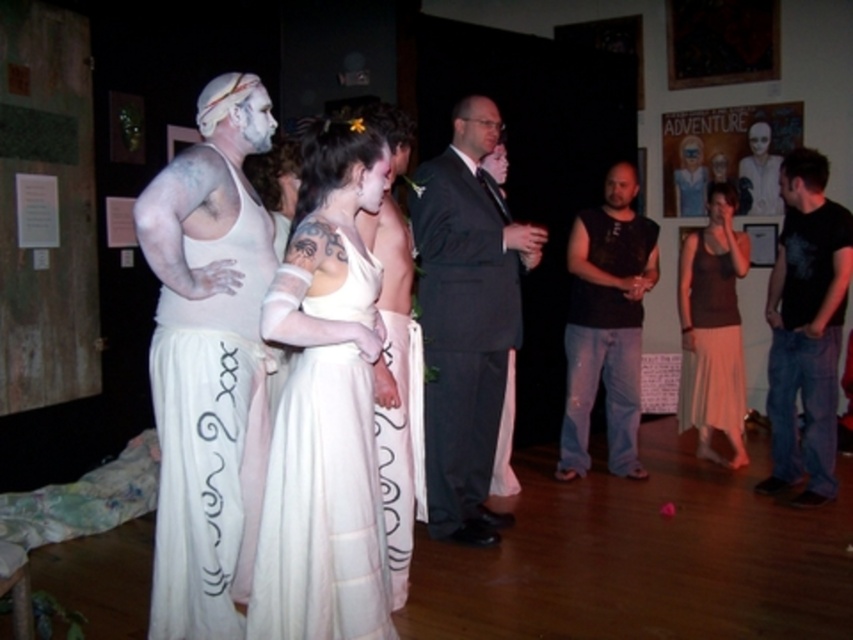
You are standing in the room and want to locate the white satin dress at center. According to the coordinates provided, where should you look?

The white satin dress at center is located at coordinates point (325, 406).

You are a photographer positioned in the room and want to capture a closeup shot of the white matte tank top at left and the white silk skirt at center. Given that your camera has a maximum focus range of 24 inches, will you be able to photograph both subjects clearly in the same frame?

The white matte tank top at left and white silk skirt at center are 24.30 inches apart, which exceeds the camera maximum focus range of 24 inches. Therefore, you cannot photograph both subjects clearly in the same frame.